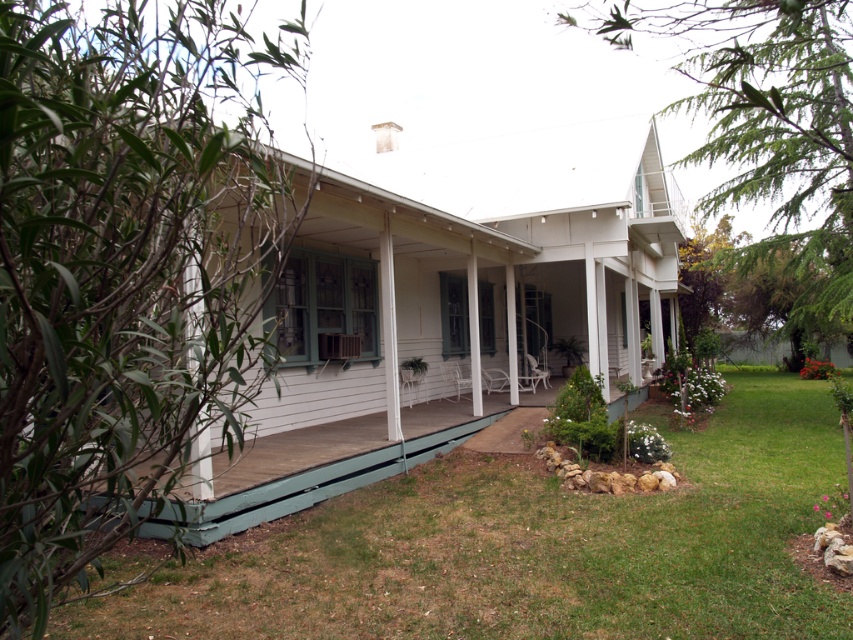
Can you confirm if green grass at lower left is positioned below white wood pillar at center?

Yes.

Can you confirm if green grass at lower left is wider than white wood pillar at center?

Yes, green grass at lower left is wider than white wood pillar at center.

Who is more forward, (572, 509) or (392, 324)?

Positioned in front is point (572, 509).

Locate an element on the screen. The height and width of the screenshot is (640, 853). green grass at lower left is located at coordinates (531, 547).

Is green painted wood porch at lower left to the right of white wood pillar at center from the viewer's perspective?

No, green painted wood porch at lower left is not to the right of white wood pillar at center.

Who is shorter, green painted wood porch at lower left or white wood pillar at center?

With less height is green painted wood porch at lower left.

Is point (418, 454) closer to camera compared to point (381, 236)?

No, it is behind (381, 236).

At what (x,y) coordinates should I click in order to perform the action: click on green painted wood porch at lower left. Please return your answer as a coordinate pair (x, y). Looking at the image, I should click on (300, 486).

Does point (433, 435) come farther from viewer compared to point (207, 454)?

Yes, point (433, 435) is behind point (207, 454).

Consider the image. Can you confirm if green painted wood porch at lower left is taller than white wood pillar at left?

No, green painted wood porch at lower left is not taller than white wood pillar at left.

Between point (577, 465) and point (194, 321), which one is positioned behind?

The point (577, 465) is more distant.

Where is `green painted wood porch at lower left`? The image size is (853, 640). green painted wood porch at lower left is located at coordinates (300, 486).